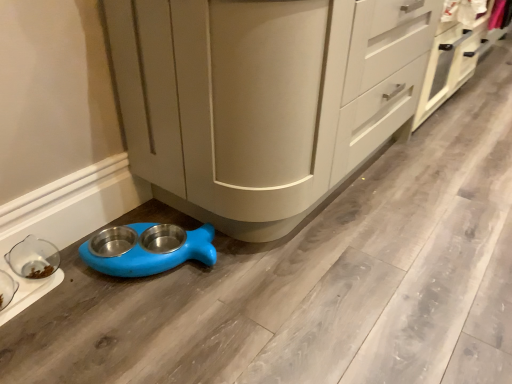
Locate an element on the screen. This screenshot has height=384, width=512. transparent glass bowl at lower left, placed as the second appliance when sorted from right to left is located at coordinates (32, 273).

Describe the element at coordinates (245, 99) in the screenshot. I see `matte beige cabinet at lower center, the first cabinetry in the left-to-right sequence` at that location.

At what (x,y) coordinates should I click in order to perform the action: click on blue plastic pet feeder at lower left, the 1th appliance positioned from the right. Please return your answer as a coordinate pair (x, y). Image resolution: width=512 pixels, height=384 pixels. Looking at the image, I should click on (147, 248).

Which of these two, transparent glass bowl at lower left, which is the first appliance from left to right, or white matte cabinet at center, the 1th cabinetry when ordered from right to left, stands taller?

Standing taller between the two is white matte cabinet at center, the 1th cabinetry when ordered from right to left.

In order to click on the 2nd appliance in front of the white matte cabinet at center, which is counted as the second cabinetry, starting from the left in this screenshot , I will do `click(32, 273)`.

Is transparent glass bowl at lower left, which is the first appliance from left to right, to the left of white matte cabinet at center, which is counted as the second cabinetry, starting from the left, from the viewer's perspective?

Indeed, transparent glass bowl at lower left, which is the first appliance from left to right, is positioned on the left side of white matte cabinet at center, which is counted as the second cabinetry, starting from the left.

Considering the sizes of matte beige cabinet at lower center, the first cabinetry in the left-to-right sequence, and white matte cabinet at center, the 1th cabinetry when ordered from right to left, in the image, is matte beige cabinet at lower center, the first cabinetry in the left-to-right sequence, wider or thinner than white matte cabinet at center, the 1th cabinetry when ordered from right to left,?

In the image, matte beige cabinet at lower center, the first cabinetry in the left-to-right sequence, appears to be wider than white matte cabinet at center, the 1th cabinetry when ordered from right to left.

From the image's perspective, would you say matte beige cabinet at lower center, marked as the second cabinetry in a right-to-left arrangement, is positioned over white matte cabinet at center, the 1th cabinetry when ordered from right to left?

Incorrect, from the image's perspective, matte beige cabinet at lower center, marked as the second cabinetry in a right-to-left arrangement, is lower than white matte cabinet at center, the 1th cabinetry when ordered from right to left.

Is blue plastic pet feeder at lower left, the 1th appliance positioned from the right, surrounded by transparent glass bowl at lower left, which is the first appliance from left to right?

That's incorrect, blue plastic pet feeder at lower left, the 1th appliance positioned from the right, is not inside transparent glass bowl at lower left, which is the first appliance from left to right.

In the scene shown: Does transparent glass bowl at lower left, placed as the second appliance when sorted from right to left, have a larger size compared to blue plastic pet feeder at lower left, which is the 2th appliance from left to right?

Incorrect, transparent glass bowl at lower left, placed as the second appliance when sorted from right to left, is not larger than blue plastic pet feeder at lower left, which is the 2th appliance from left to right.

Is transparent glass bowl at lower left, placed as the second appliance when sorted from right to left, placed right next to blue plastic pet feeder at lower left, the 1th appliance positioned from the right?

transparent glass bowl at lower left, placed as the second appliance when sorted from right to left, is not next to blue plastic pet feeder at lower left, the 1th appliance positioned from the right, and they're not touching.

Considering the positions of point (16, 256) and point (188, 246), is point (16, 256) closer or farther from the camera than point (188, 246)?

Point (16, 256) is positioned closer to the camera compared to point (188, 246).

Choose the correct answer: Is transparent glass bowl at lower left, placed as the second appliance when sorted from right to left, inside matte beige cabinet at lower center, marked as the second cabinetry in a right-to-left arrangement, or outside it?

transparent glass bowl at lower left, placed as the second appliance when sorted from right to left, lies outside matte beige cabinet at lower center, marked as the second cabinetry in a right-to-left arrangement.

Which of these two, transparent glass bowl at lower left, placed as the second appliance when sorted from right to left, or matte beige cabinet at lower center, the first cabinetry in the left-to-right sequence, is bigger?

matte beige cabinet at lower center, the first cabinetry in the left-to-right sequence, is bigger.

Where is `the 2nd cabinetry directly above the transparent glass bowl at lower left, placed as the second appliance when sorted from right to left (from a real-world perspective)`? This screenshot has width=512, height=384. the 2nd cabinetry directly above the transparent glass bowl at lower left, placed as the second appliance when sorted from right to left (from a real-world perspective) is located at coordinates (245, 99).

From a real-world perspective, is matte beige cabinet at lower center, the first cabinetry in the left-to-right sequence, over transparent glass bowl at lower left, which is the first appliance from left to right?

Indeed, from a real-world perspective, matte beige cabinet at lower center, the first cabinetry in the left-to-right sequence, stands above transparent glass bowl at lower left, which is the first appliance from left to right.

From the image's perspective, is matte beige cabinet at lower center, marked as the second cabinetry in a right-to-left arrangement, above or below transparent glass bowl at lower left, placed as the second appliance when sorted from right to left?

matte beige cabinet at lower center, marked as the second cabinetry in a right-to-left arrangement, is situated higher than transparent glass bowl at lower left, placed as the second appliance when sorted from right to left, in the image.

Is matte beige cabinet at lower center, the first cabinetry in the left-to-right sequence, taller or shorter than transparent glass bowl at lower left, which is the first appliance from left to right?

In the image, matte beige cabinet at lower center, the first cabinetry in the left-to-right sequence, appears to be taller than transparent glass bowl at lower left, which is the first appliance from left to right.

Can you tell me how much matte beige cabinet at lower center, marked as the second cabinetry in a right-to-left arrangement, and transparent glass bowl at lower left, placed as the second appliance when sorted from right to left, differ in facing direction?

matte beige cabinet at lower center, marked as the second cabinetry in a right-to-left arrangement, and transparent glass bowl at lower left, placed as the second appliance when sorted from right to left, are facing 3.2 degrees away from each other.

Considering the relative positions of blue plastic pet feeder at lower left, which is the 2th appliance from left to right, and white matte cabinet at center, the 1th cabinetry when ordered from right to left, in the image provided, is blue plastic pet feeder at lower left, which is the 2th appliance from left to right, to the left of white matte cabinet at center, the 1th cabinetry when ordered from right to left, from the viewer's perspective?

Yes.

Is blue plastic pet feeder at lower left, the 1th appliance positioned from the right, far from white matte cabinet at center, the 1th cabinetry when ordered from right to left?

Yes, blue plastic pet feeder at lower left, the 1th appliance positioned from the right, is far from white matte cabinet at center, the 1th cabinetry when ordered from right to left.

Which point is more distant from viewer, (x=214, y=231) or (x=457, y=82)?

Positioned behind is point (x=457, y=82).

Based on their sizes in the image, would you say white matte cabinet at center, which is counted as the second cabinetry, starting from the left, is bigger or smaller than transparent glass bowl at lower left, placed as the second appliance when sorted from right to left?

Clearly, white matte cabinet at center, which is counted as the second cabinetry, starting from the left, is larger in size than transparent glass bowl at lower left, placed as the second appliance when sorted from right to left.

From a real-world perspective, is white matte cabinet at center, which is counted as the second cabinetry, starting from the left, located higher than transparent glass bowl at lower left, placed as the second appliance when sorted from right to left?

Yes, from a real-world perspective, white matte cabinet at center, which is counted as the second cabinetry, starting from the left, is above transparent glass bowl at lower left, placed as the second appliance when sorted from right to left.

Consider the image. Could transparent glass bowl at lower left, placed as the second appliance when sorted from right to left, be considered to be inside white matte cabinet at center, which is counted as the second cabinetry, starting from the left?

That's incorrect, transparent glass bowl at lower left, placed as the second appliance when sorted from right to left, is not inside white matte cabinet at center, which is counted as the second cabinetry, starting from the left.

The height and width of the screenshot is (384, 512). In order to click on the 2nd appliance in front when counting from the white matte cabinet at center, the 1th cabinetry when ordered from right to left in this screenshot , I will do `click(32, 273)`.

The image size is (512, 384). What are the coordinates of `cabinetry that appears below the matte beige cabinet at lower center, marked as the second cabinetry in a right-to-left arrangement (from a real-world perspective)` in the screenshot? It's located at (453, 64).

Estimate the real-world distances between objects in this image. Which object is further from white matte cabinet at center, which is counted as the second cabinetry, starting from the left, blue plastic pet feeder at lower left, the 1th appliance positioned from the right, or transparent glass bowl at lower left, placed as the second appliance when sorted from right to left?

transparent glass bowl at lower left, placed as the second appliance when sorted from right to left.

When comparing their distances from transparent glass bowl at lower left, placed as the second appliance when sorted from right to left, does matte beige cabinet at lower center, the first cabinetry in the left-to-right sequence, or white matte cabinet at center, which is counted as the second cabinetry, starting from the left, seem further?

white matte cabinet at center, which is counted as the second cabinetry, starting from the left, lies further to transparent glass bowl at lower left, placed as the second appliance when sorted from right to left, than the other object.

Estimate the real-world distances between objects in this image. Which object is closer to transparent glass bowl at lower left, placed as the second appliance when sorted from right to left, white matte cabinet at center, which is counted as the second cabinetry, starting from the left, or matte beige cabinet at lower center, the first cabinetry in the left-to-right sequence?

The object closer to transparent glass bowl at lower left, placed as the second appliance when sorted from right to left, is matte beige cabinet at lower center, the first cabinetry in the left-to-right sequence.

From the image, which object appears to be nearer to white matte cabinet at center, which is counted as the second cabinetry, starting from the left, matte beige cabinet at lower center, marked as the second cabinetry in a right-to-left arrangement, or blue plastic pet feeder at lower left, which is the 2th appliance from left to right?

matte beige cabinet at lower center, marked as the second cabinetry in a right-to-left arrangement, lies closer to white matte cabinet at center, which is counted as the second cabinetry, starting from the left, than the other object.

Which object lies nearer to the anchor point matte beige cabinet at lower center, marked as the second cabinetry in a right-to-left arrangement, white matte cabinet at center, the 1th cabinetry when ordered from right to left, or blue plastic pet feeder at lower left, which is the 2th appliance from left to right?

Among the two, blue plastic pet feeder at lower left, which is the 2th appliance from left to right, is located nearer to matte beige cabinet at lower center, marked as the second cabinetry in a right-to-left arrangement.

Which object lies nearer to the anchor point matte beige cabinet at lower center, marked as the second cabinetry in a right-to-left arrangement, blue plastic pet feeder at lower left, which is the 2th appliance from left to right, or transparent glass bowl at lower left, placed as the second appliance when sorted from right to left?

Based on the image, blue plastic pet feeder at lower left, which is the 2th appliance from left to right, appears to be nearer to matte beige cabinet at lower center, marked as the second cabinetry in a right-to-left arrangement.

Considering their positions, is blue plastic pet feeder at lower left, which is the 2th appliance from left to right, positioned closer to transparent glass bowl at lower left, placed as the second appliance when sorted from right to left, than matte beige cabinet at lower center, marked as the second cabinetry in a right-to-left arrangement?

blue plastic pet feeder at lower left, which is the 2th appliance from left to right.

Based on their spatial positions, is blue plastic pet feeder at lower left, which is the 2th appliance from left to right, or white matte cabinet at center, the 1th cabinetry when ordered from right to left, further from matte beige cabinet at lower center, marked as the second cabinetry in a right-to-left arrangement?

white matte cabinet at center, the 1th cabinetry when ordered from right to left, is positioned further to the anchor matte beige cabinet at lower center, marked as the second cabinetry in a right-to-left arrangement.

Where is `appliance situated between transparent glass bowl at lower left, placed as the second appliance when sorted from right to left, and white matte cabinet at center, the 1th cabinetry when ordered from right to left, from left to right`? This screenshot has width=512, height=384. appliance situated between transparent glass bowl at lower left, placed as the second appliance when sorted from right to left, and white matte cabinet at center, the 1th cabinetry when ordered from right to left, from left to right is located at coordinates (147, 248).

Locate an element on the screen. The image size is (512, 384). cabinetry situated between transparent glass bowl at lower left, placed as the second appliance when sorted from right to left, and white matte cabinet at center, the 1th cabinetry when ordered from right to left, from left to right is located at coordinates (245, 99).

Locate an element on the screen. Image resolution: width=512 pixels, height=384 pixels. cabinetry located between blue plastic pet feeder at lower left, which is the 2th appliance from left to right, and white matte cabinet at center, which is counted as the second cabinetry, starting from the left, in the left-right direction is located at coordinates (245, 99).

This screenshot has height=384, width=512. I want to click on appliance situated between transparent glass bowl at lower left, placed as the second appliance when sorted from right to left, and matte beige cabinet at lower center, the first cabinetry in the left-to-right sequence, from left to right, so click(x=147, y=248).